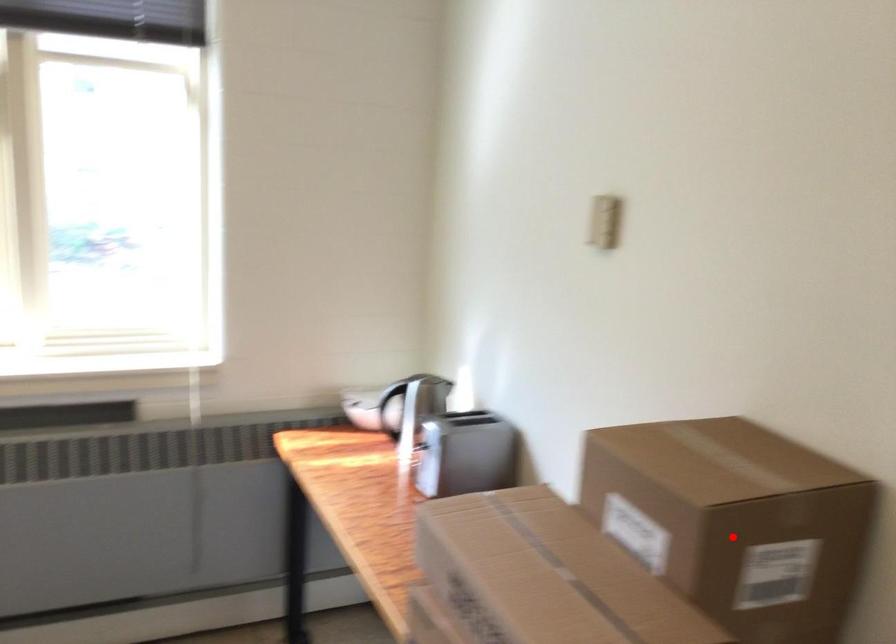
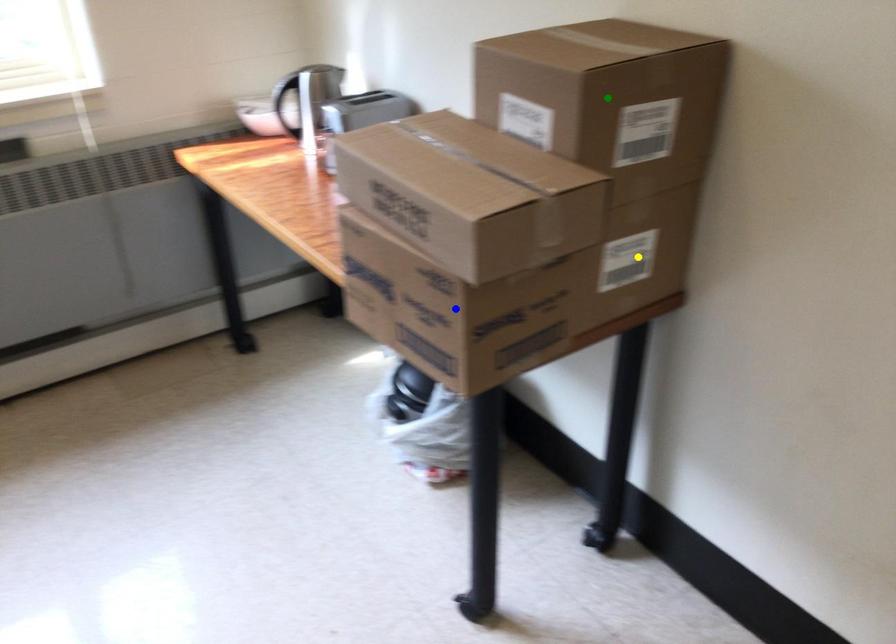
Question: I am providing you with two images of the same scene from different viewpoints. A red point is marked on the first image. You are given multiple points on the second image. Which mark in image 2 goes with the point in image 1?

Choices:
 (A) green point
 (B) yellow point
 (C) blue point

Answer: (A)